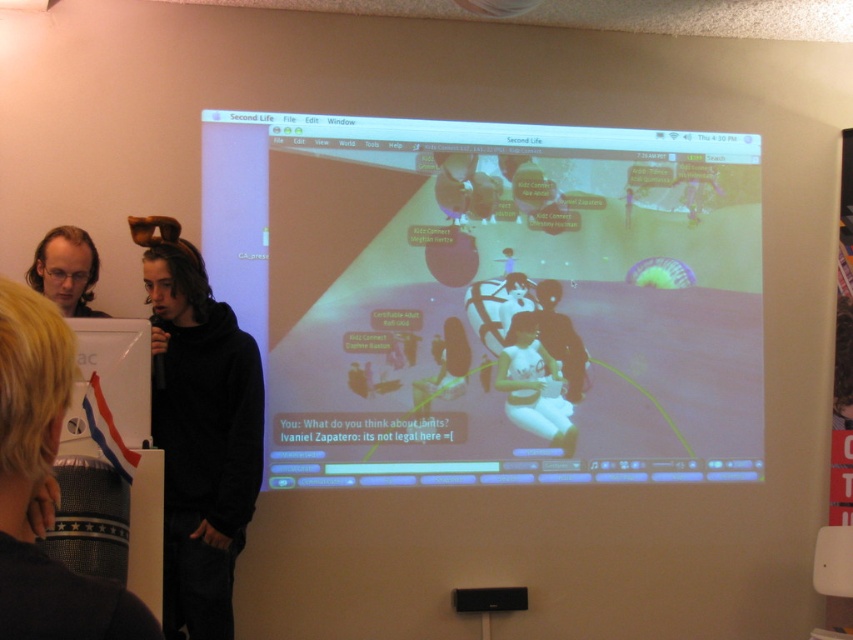
Question: Can you confirm if blonde hair at lower left is bigger than white matte dress at center?

Choices:
 (A) no
 (B) yes

Answer: (B)

Question: Can you confirm if black hoodie at left is thinner than matte black hair at upper left?

Choices:
 (A) yes
 (B) no

Answer: (B)

Question: Which point is closer to the camera?

Choices:
 (A) (512, 285)
 (B) (514, 419)
 (C) (67, 296)

Answer: (C)

Question: Considering the real-world distances, which object is closest to the white matte dress at center?

Choices:
 (A) matte plastic screen at center
 (B) matte black hair at upper left
 (C) blonde hair at lower left

Answer: (A)

Question: Among these objects, which one is farthest from the camera?

Choices:
 (A) matte black hair at upper left
 (B) white matte dress at center
 (C) blonde hair at lower left

Answer: (B)

Question: Considering the relative positions of black hoodie at left and blonde hair at lower left in the image provided, where is black hoodie at left located with respect to blonde hair at lower left?

Choices:
 (A) left
 (B) right

Answer: (A)